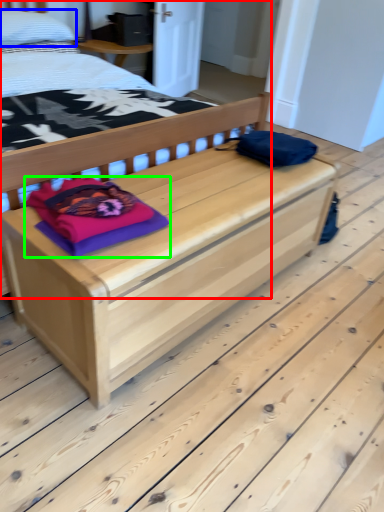
Question: Which object is the farthest from bed (highlighted by a red box)? Choose among these: pillow (highlighted by a blue box) or material (highlighted by a green box).

Choices:
 (A) pillow
 (B) material

Answer: (B)